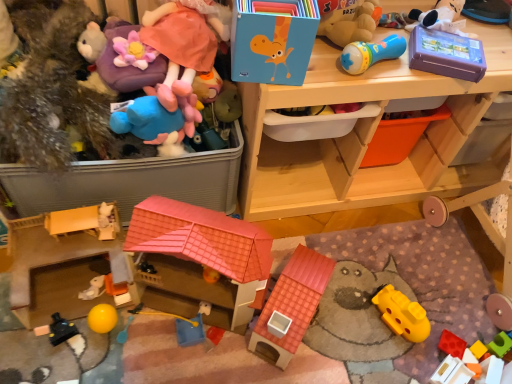
Identify the location of free space to the left of blue plastic toy at center, the 8th toy viewed from the left. (136, 338).